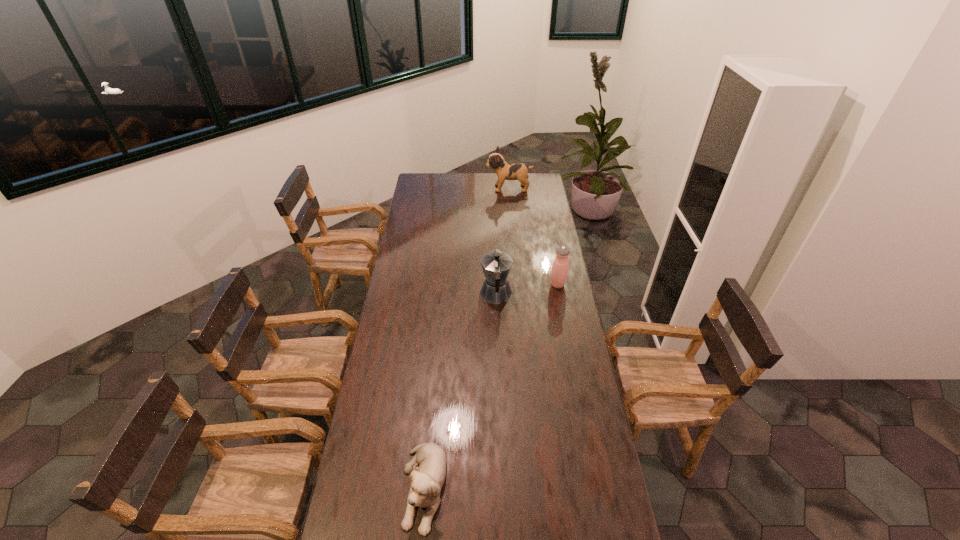
The height and width of the screenshot is (540, 960). I want to click on vacant position located 0.070m at the spout of the coffeepot, so (x=495, y=270).

In order to click on free location located 0.230m at the spout of the coffeepot in this screenshot , I will do `click(494, 251)`.

The height and width of the screenshot is (540, 960). I want to click on free space located 0.340m on the left of the rightmost object, so click(480, 285).

Locate an element on the screen. object located at the far edge is located at coordinates (505, 171).

I want to click on puppy present at the right edge, so click(505, 171).

The height and width of the screenshot is (540, 960). In order to click on thermos bottle that is at the right edge in this screenshot , I will do `click(560, 268)`.

Identify the location of object that is at the far right corner. Image resolution: width=960 pixels, height=540 pixels. (505, 171).

You are a GUI agent. You are given a task and a screenshot of the screen. Output one action in this format:
    pyautogui.click(x=<x>, y=<y>)
    Task: Click on the vacant space at the far edge of the desktop
    Image resolution: width=960 pixels, height=540 pixels.
    Given the screenshot: What is the action you would take?
    pyautogui.click(x=457, y=182)

At what (x,y) coordinates should I click in order to perform the action: click on vacant position at the left edge of the desktop. Please return your answer as a coordinate pair (x, y). Image resolution: width=960 pixels, height=540 pixels. Looking at the image, I should click on (402, 358).

I want to click on vacant space at the right edge of the desktop, so click(x=552, y=359).